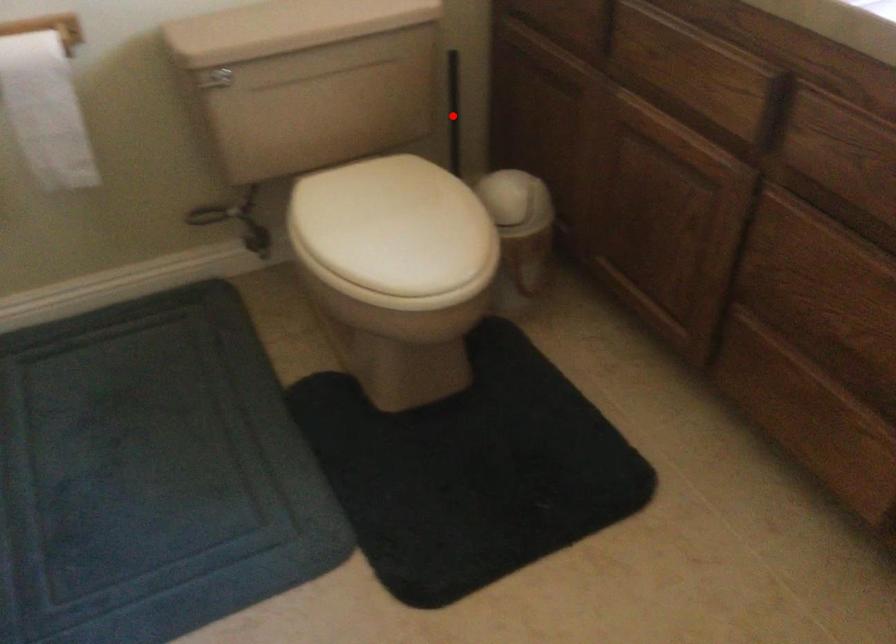
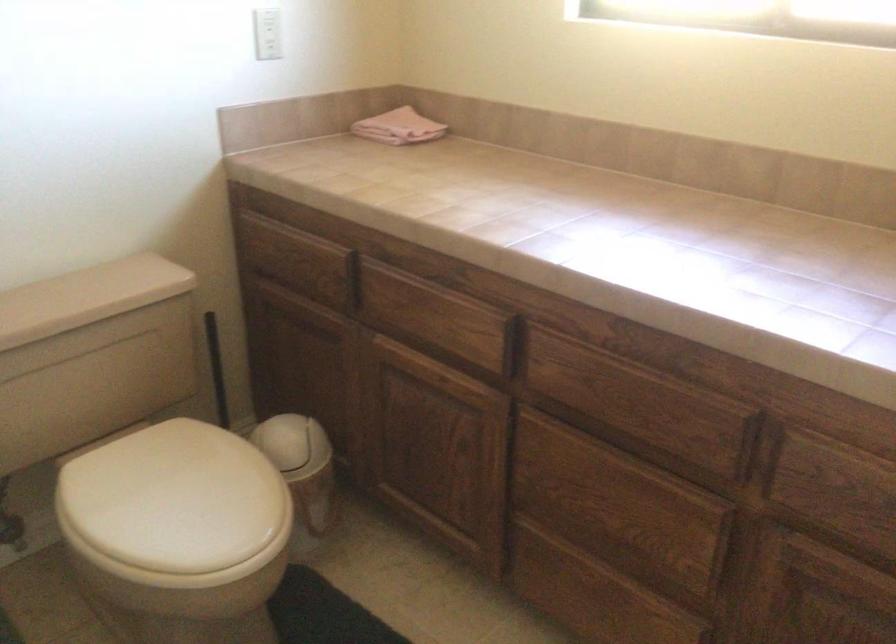
Find the pixel in the second image that matches the highlighted location in the first image.

(216, 368)